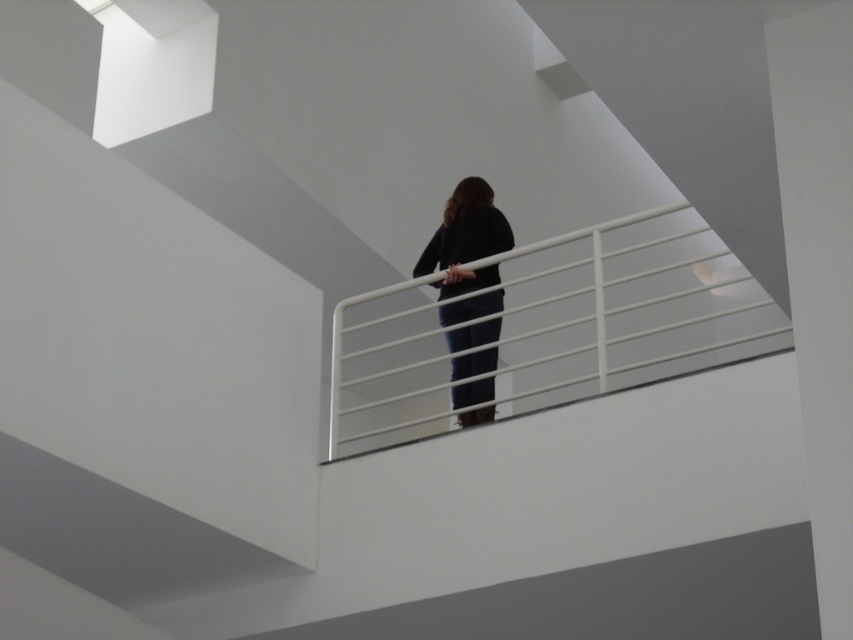
Which of these two, white metal rail at upper center or black matte pants at center, stands taller?

With more height is white metal rail at upper center.

Is white metal rail at upper center below black matte pants at center?

No.

The height and width of the screenshot is (640, 853). What do you see at coordinates (624, 307) in the screenshot? I see `white metal rail at upper center` at bounding box center [624, 307].

Locate an element on the screen. white metal rail at upper center is located at coordinates (624, 307).